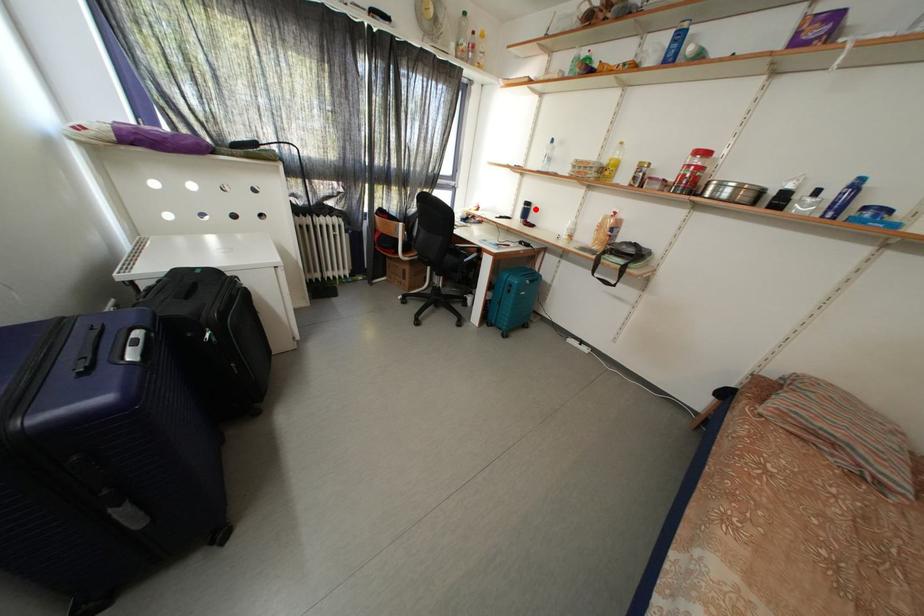
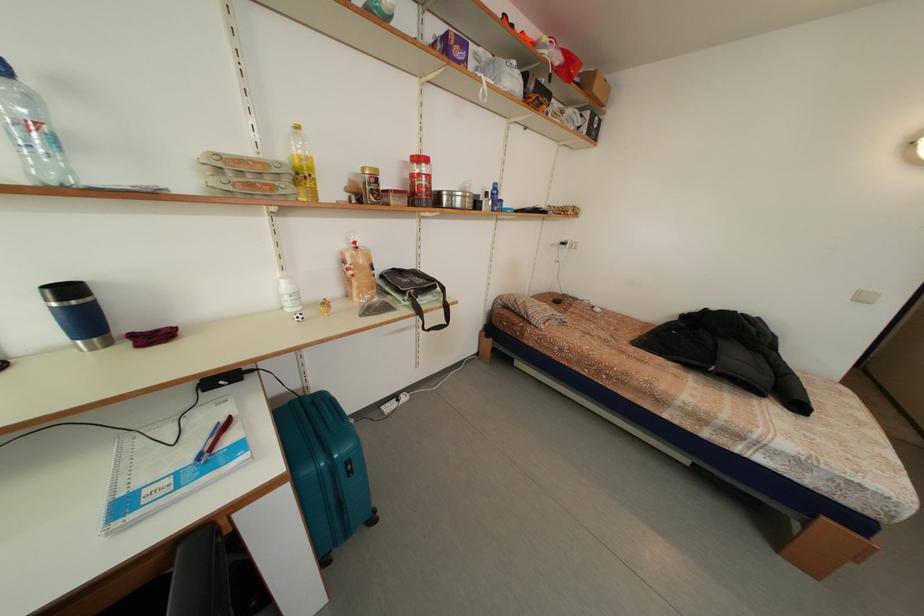
Question: I am providing you with two images of the same scene from different viewpoints. A red point is shown in image1. For the corresponding object point in image2, is it positioned nearer or farther from the camera?

Choices:
 (A) Nearer
 (B) Farther

Answer: (B)